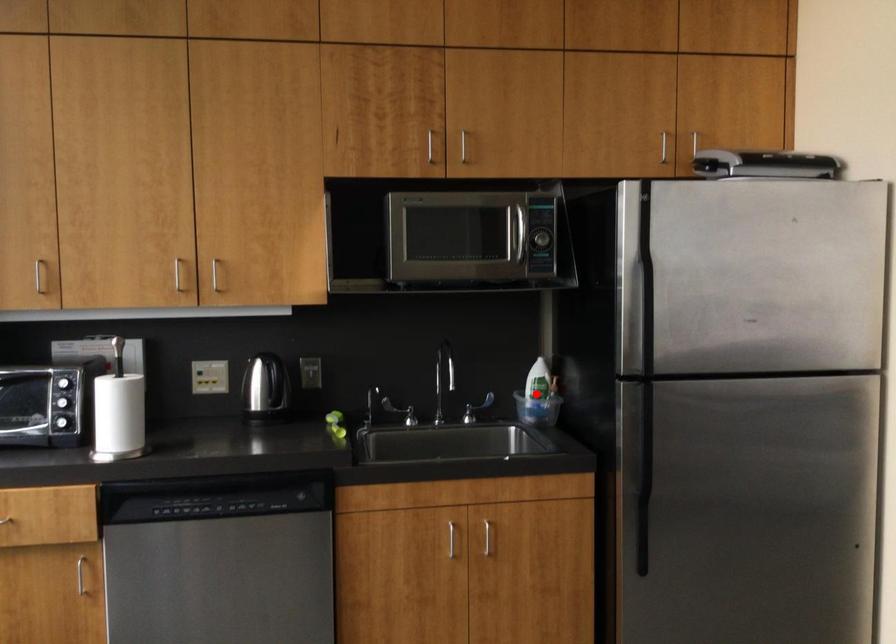
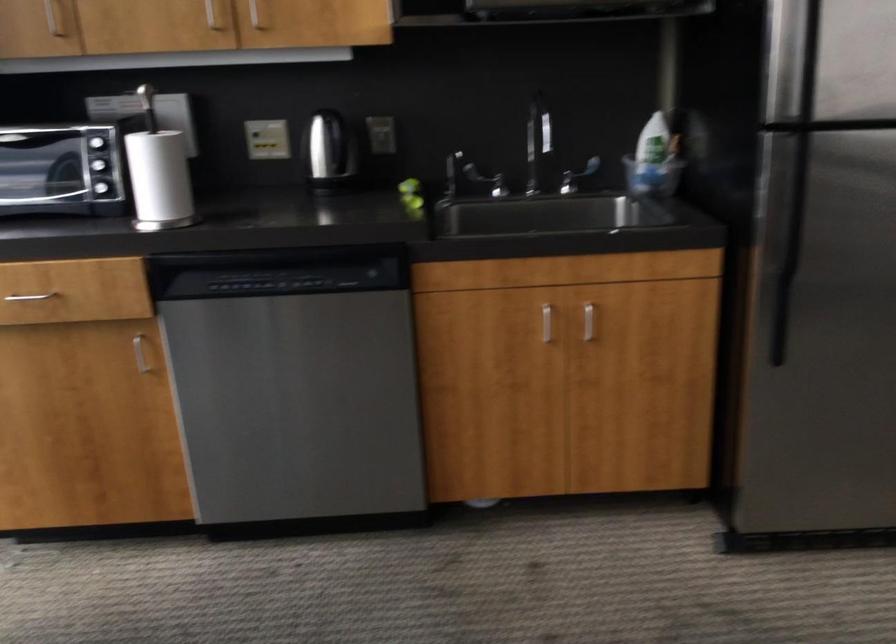
Question: I am providing you with two images of the same scene from different viewpoints. In image1, a red point is highlighted. Considering the same 3D point in image2, which of the following is correct?

Choices:
 (A) It is closer
 (B) It is farther

Answer: (A)